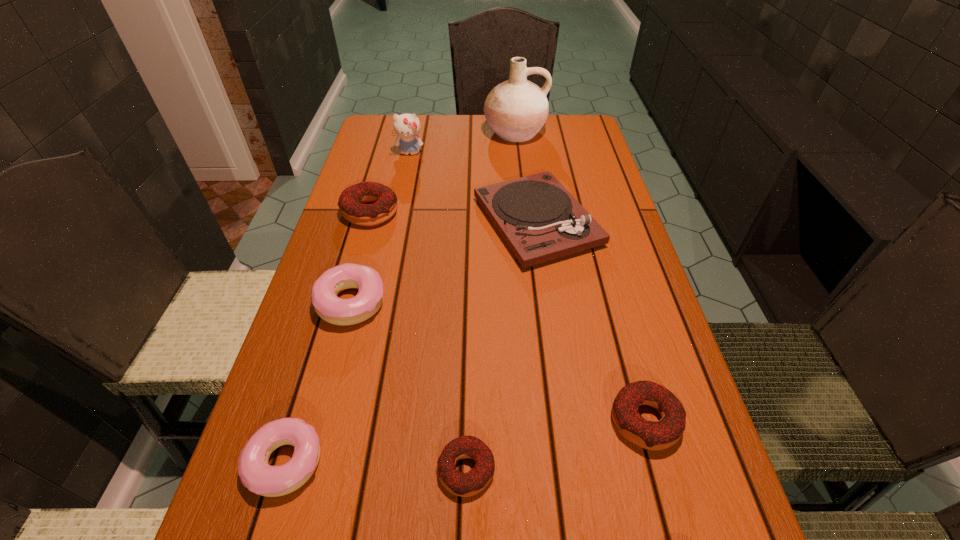
You are a GUI agent. You are given a task and a screenshot of the screen. Output one action in this format:
    pyautogui.click(x=<x>, y=<y>)
    Task: Click on the nearer pink doughnut
    The image size is (960, 540).
    Given the screenshot: What is the action you would take?
    pyautogui.click(x=256, y=474)

Where is `the shortest doughnut`? the shortest doughnut is located at coordinates (471, 483).

Where is `the smallest chocolate doughnut`? The width and height of the screenshot is (960, 540). the smallest chocolate doughnut is located at coordinates (471, 483).

In order to click on free location located 0.050m to pour from the handle of the pottery in this screenshot , I will do `click(517, 157)`.

Image resolution: width=960 pixels, height=540 pixels. Find the location of `free space located 0.050m on the front-facing side of the seventh shortest object`. free space located 0.050m on the front-facing side of the seventh shortest object is located at coordinates (406, 168).

The height and width of the screenshot is (540, 960). What are the coordinates of `vacant space located on the left of the phonograph_record` in the screenshot? It's located at (426, 222).

You are a GUI agent. You are given a task and a screenshot of the screen. Output one action in this format:
    pyautogui.click(x=<x>, y=<y>)
    Task: Click on the vacant space positioned 0.160m on the right of the leftmost chocolate doughnut
    Image resolution: width=960 pixels, height=540 pixels.
    Given the screenshot: What is the action you would take?
    pyautogui.click(x=460, y=212)

The height and width of the screenshot is (540, 960). What are the coordinates of `free space located on the right of the bigger pink doughnut` in the screenshot? It's located at coord(495,302).

What are the coordinates of `vacant space situated 0.130m on the left of the second smallest chocolate doughnut` in the screenshot? It's located at (534, 420).

Locate an element on the screen. The height and width of the screenshot is (540, 960). vacant area situated 0.310m on the right of the smaller pink doughnut is located at coordinates (518, 462).